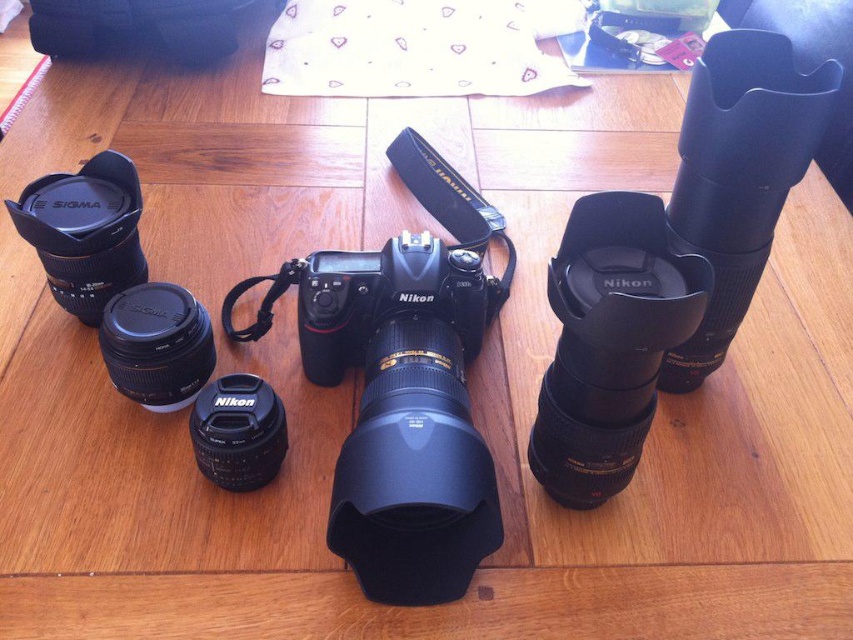
Based on the photo, you are a photographer setting up equipment. You have a black rubberized lens at upper right and a matte black lens at lower left. Which lens should you choose if you need a taller one for a specific shot?

The black rubberized lens at upper right is much taller than the matte black lens at lower left, so you should choose the black rubberized lens at upper right for the specific shot.

Consider the image. You are setting up a photography studio and need to place a new tripod in the center of the wooden surface. The Nikon DSLR camera is already centrally positioned. Where should you place the tripod relative to the matte black lens at left to ensure it doesn not obstruct the camera?

The matte black lens at left is located at point (x=85, y=230). Since the Nikon DSLR camera is centrally positioned, placing the tripod in the center will not obstruct the camera as the lens is positioned to the left of the center.

You are a photographer who needs to place a 25 cm long tripod between the matte black lens at left and the black rubber lens cap at lower center. Will the tripod fit in the space between them?

The distance between the matte black lens at left and the black rubber lens cap at lower center is 24.43 centimeters. Since the tripod is 25 cm long, it will not fit in the space between them as the available space is slightly shorter than the tripod.